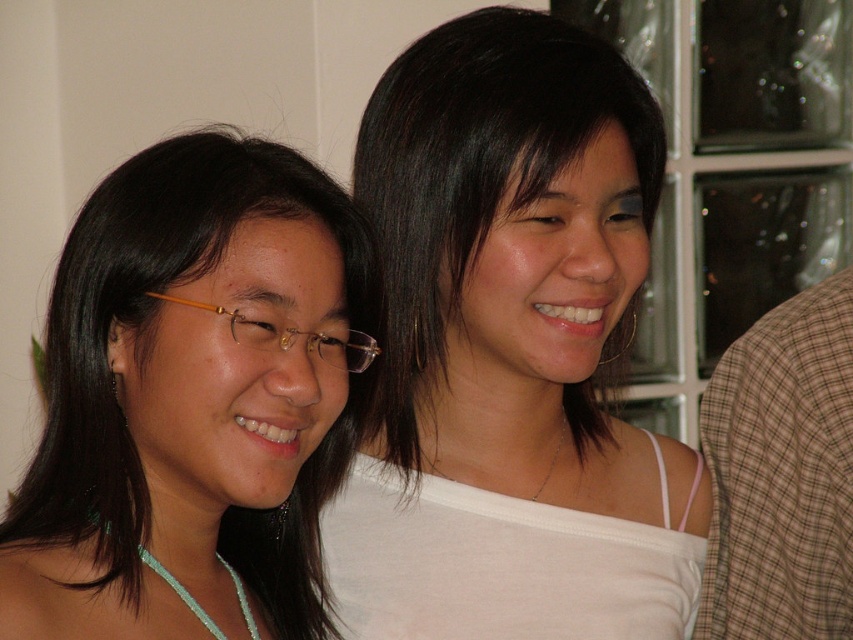
Question: Does matte gold glasses at left appear under brown plaid shirt at right?

Choices:
 (A) yes
 (B) no

Answer: (B)

Question: Estimate the real-world distances between objects in this image. Which object is farther from the brown plaid shirt at right?

Choices:
 (A) white matte tank top at center
 (B) matte gold glasses at left

Answer: (B)

Question: Which of these objects is positioned farthest from the brown plaid shirt at right?

Choices:
 (A) matte gold glasses at left
 (B) white matte tank top at center

Answer: (A)

Question: Estimate the real-world distances between objects in this image. Which object is farther from the brown plaid shirt at right?

Choices:
 (A) matte gold glasses at left
 (B) white matte tank top at center

Answer: (A)

Question: Does white matte tank top at center have a larger size compared to brown plaid shirt at right?

Choices:
 (A) no
 (B) yes

Answer: (B)

Question: Is matte gold glasses at left smaller than brown plaid shirt at right?

Choices:
 (A) no
 (B) yes

Answer: (A)